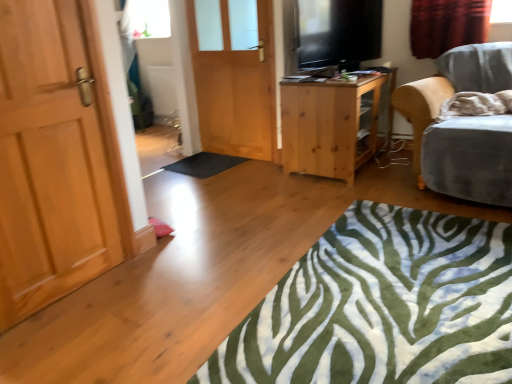
What are the coordinates of `vacant area situated below green zebra-patterned rug at lower center (from a real-world perspective)` in the screenshot? It's located at (397, 290).